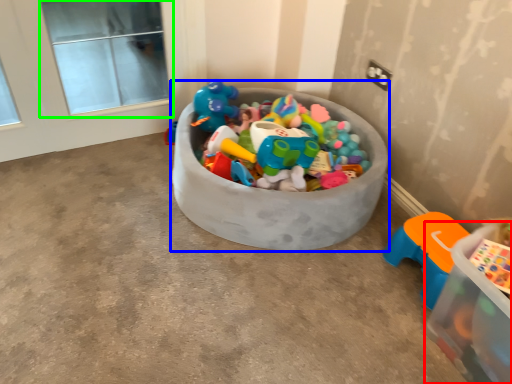
Question: Considering the real-world distances, which object is closest to storage box (highlighted by a red box)? storage box (highlighted by a blue box) or window screen (highlighted by a green box).

Choices:
 (A) storage box
 (B) window screen

Answer: (A)